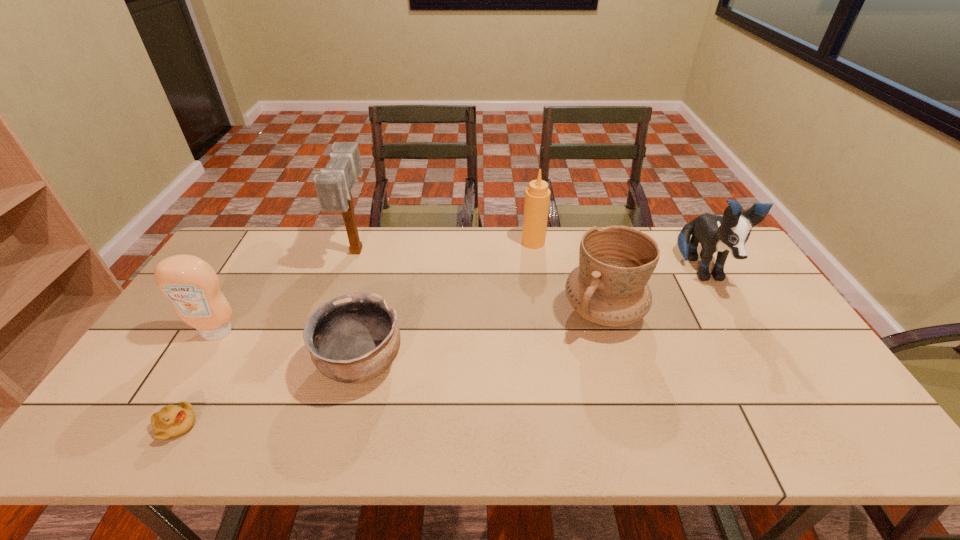
Locate an element on the screen. The width and height of the screenshot is (960, 540). free area in between the shortest object and the second object from right to left is located at coordinates (390, 369).

Image resolution: width=960 pixels, height=540 pixels. Identify the location of free area in between the mallet and the nearer condiment. (287, 291).

The height and width of the screenshot is (540, 960). I want to click on empty location between the right condiment and the mallet, so click(445, 246).

At what (x,y) coordinates should I click in order to perform the action: click on unoccupied area between the shortest object and the left condiment. Please return your answer as a coordinate pair (x, y). Looking at the image, I should click on (196, 379).

In order to click on free space between the shortest object and the taller pottery in this screenshot , I will do `click(390, 369)`.

The height and width of the screenshot is (540, 960). What are the coordinates of `vacant space in between the sixth tallest object and the puppy` in the screenshot? It's located at (531, 318).

Where is `vacant area that lies between the duckling and the taller pottery`? vacant area that lies between the duckling and the taller pottery is located at coordinates (390, 369).

Identify the location of object that can be found as the second closest to the rightmost object. (537, 196).

Point out which object is positioned as the nearest to the left condiment. Please provide its 2D coordinates. Your answer should be formatted as a tuple, i.e. [(x, y)], where the tuple contains the x and y coordinates of a point satisfying the conditions above.

[(171, 421)]

Where is `free spot that satisfies the following two spatial constraints: 1. on the back side of the mallet; 2. on the left side of the farther condiment`? This screenshot has height=540, width=960. free spot that satisfies the following two spatial constraints: 1. on the back side of the mallet; 2. on the left side of the farther condiment is located at coordinates (360, 242).